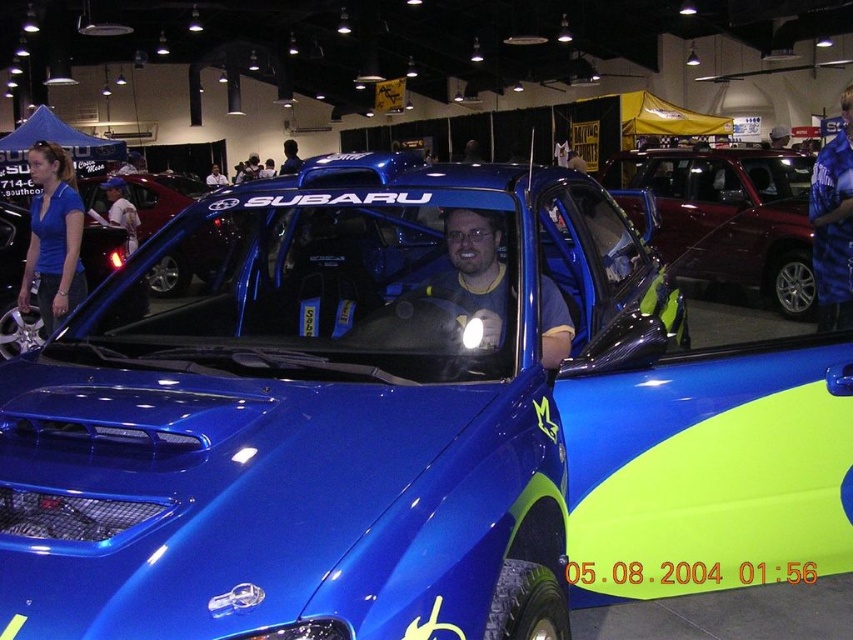
Does point (49, 305) lie in front of point (99, 182)?

Yes, it is.

Is point (73, 189) positioned before point (154, 195)?

Yes, point (73, 189) is closer to viewer.

Where is `matte blue shirt at left`? The width and height of the screenshot is (853, 640). matte blue shirt at left is located at coordinates (53, 237).

Does matte blue car at center have a greater height compared to matte blue helmet at center?

Indeed, matte blue car at center has a greater height compared to matte blue helmet at center.

Can you confirm if matte blue car at center is thinner than matte blue helmet at center?

No, matte blue car at center is not thinner than matte blue helmet at center.

What do you see at coordinates (190, 259) in the screenshot?
I see `matte blue car at center` at bounding box center [190, 259].

Find the location of a particular element. This screenshot has height=640, width=853. matte blue car at center is located at coordinates (190, 259).

Is matte black helmet at center positioned in front of matte blue helmet at center?

Yes, it is in front of matte blue helmet at center.

Is point (283, 148) positioned before point (213, 172)?

No, it is not.

At what (x,y) coordinates should I click in order to perform the action: click on matte black helmet at center. Please return your answer as a coordinate pair (x, y). The image size is (853, 640). Looking at the image, I should click on (289, 157).